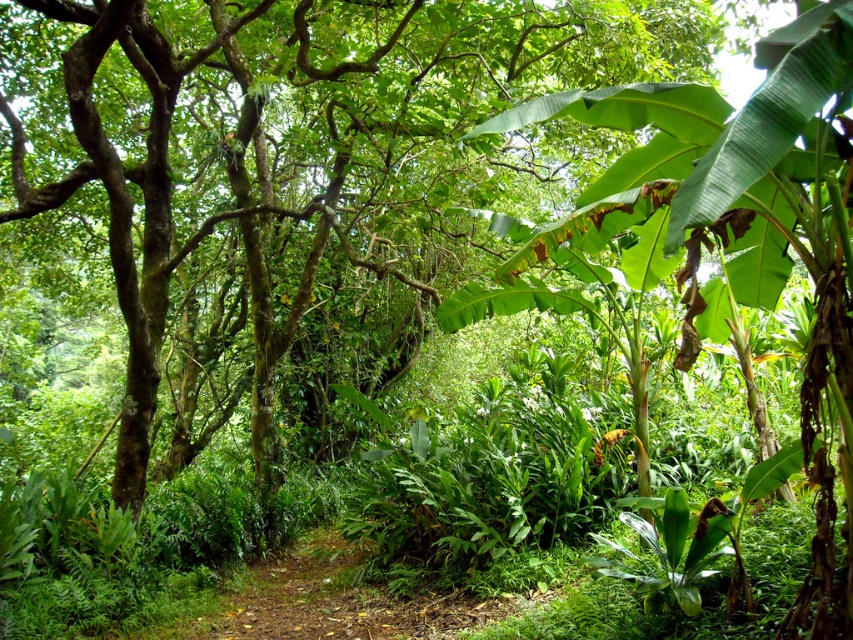
In the scene shown: You are a hiker navigating the jungle path and want to reach the green leafy banana tree at right. Which direction should you move relative to the green leafy tree at center to get there?

To reach the green leafy banana tree at right, you should move to the right of the green leafy tree at center since the banana tree is positioned to the right side of the frame and the green leafy tree at center is closer to you, blocking your direct path.

You are standing in the jungle and want to reach the green leafy tree at center. If your average walking speed is 1.5 meters per second, how many seconds will it take you to reach the tree?

The distance between you and the green leafy tree at center is 6.20 meters. At a walking speed of 1.5 meters per second, it will take approximately 4.13 seconds to reach the tree.